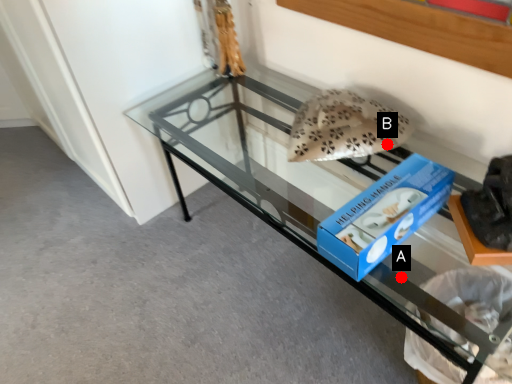
Question: Two points are circled on the image, labeled by A and B beside each circle. Which point is farther from the camera taking this photo?

Choices:
 (A) A is further
 (B) B is further

Answer: (B)